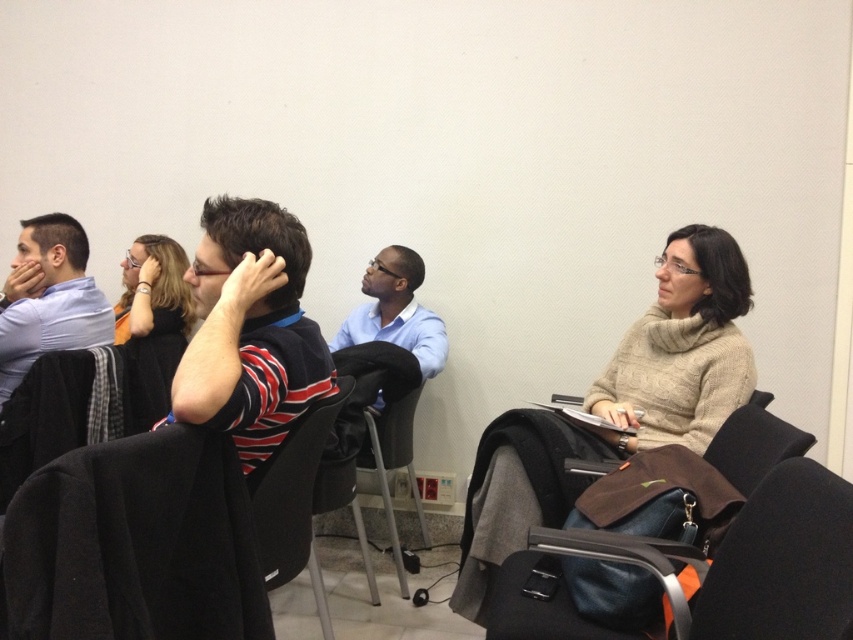
Can you confirm if striped cotton shirt at center is thinner than black fabric chair at center?

In fact, striped cotton shirt at center might be wider than black fabric chair at center.

Where is `striped cotton shirt at center`? This screenshot has height=640, width=853. striped cotton shirt at center is located at coordinates (250, 330).

Is black leather chair at lower right below black fabric chair at center?

Indeed, black leather chair at lower right is positioned under black fabric chair at center.

Is black leather chair at lower right closer to camera compared to black fabric chair at center?

That is True.

Is point (799, 624) less distant than point (260, 502)?

Yes, point (799, 624) is closer to viewer.

The width and height of the screenshot is (853, 640). I want to click on black leather chair at lower right, so click(782, 561).

Between light blue shirt at center and black fabric chair at center, which one appears on the left side from the viewer's perspective?

Positioned to the left is black fabric chair at center.

Looking at this image, which of these two, light blue shirt at center or black fabric chair at center, stands shorter?

light blue shirt at center is shorter.

Describe the element at coordinates (384, 344) in the screenshot. Image resolution: width=853 pixels, height=640 pixels. I see `light blue shirt at center` at that location.

Identify the location of light blue shirt at center. [384, 344].